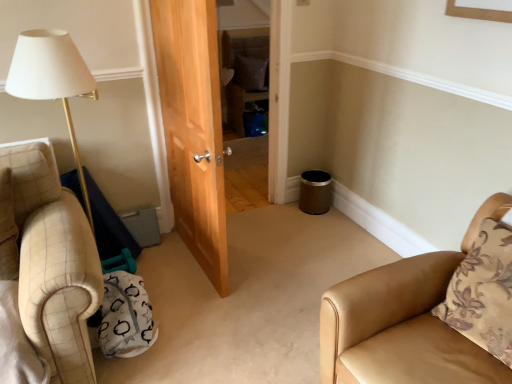
The width and height of the screenshot is (512, 384). Find the location of `brown fabric pillow at center, which appears as the 1th pillow when viewed from the left`. brown fabric pillow at center, which appears as the 1th pillow when viewed from the left is located at coordinates (x=251, y=73).

What do you see at coordinates (251, 73) in the screenshot? This screenshot has width=512, height=384. I see `brown fabric pillow at center, the second pillow positioned from the front` at bounding box center [251, 73].

Find the location of a particular element. Image resolution: width=512 pixels, height=384 pixels. brown fabric pillow at center, acting as the second pillow starting from the bottom is located at coordinates (251, 73).

From the image's perspective, is brown fabric pillow at center, the first pillow viewed from the back, below tan leather chair at lower right?

Incorrect, from the image's perspective, brown fabric pillow at center, the first pillow viewed from the back, is higher than tan leather chair at lower right.

Which is less distant, (250, 76) or (354, 294)?

The point (354, 294) is more forward.

Looking at the image, does brown fabric pillow at center, which is the 1th pillow in top-to-bottom order, seem bigger or smaller compared to tan leather chair at lower right?

Clearly, brown fabric pillow at center, which is the 1th pillow in top-to-bottom order, is smaller in size than tan leather chair at lower right.

Considering the sizes of brown fabric pillow at center, which appears as the 1th pillow when viewed from the left, and tan leather chair at lower right in the image, is brown fabric pillow at center, which appears as the 1th pillow when viewed from the left, taller or shorter than tan leather chair at lower right?

Clearly, brown fabric pillow at center, which appears as the 1th pillow when viewed from the left, is shorter compared to tan leather chair at lower right.

Does tan leather chair at lower right appear on the right side of brown fabric pillow at center, the second pillow positioned from the front?

Yes.

From the picture: Can you confirm if tan leather chair at lower right is shorter than brown fabric pillow at center, which is the second pillow from right to left?

No.

From the picture: From a real-world perspective, is tan leather chair at lower right below brown fabric pillow at center, which is the second pillow from right to left?

Yes.

From a real-world perspective, between brown floral pillow at right, positioned as the 1th pillow in right-to-left order, and tan leather chair at lower right, who is vertically lower?

tan leather chair at lower right is physically lower.

How many degrees apart are the facing directions of brown floral pillow at right, which ranks as the second pillow in left-to-right order, and tan leather chair at lower right?

brown floral pillow at right, which ranks as the second pillow in left-to-right order, and tan leather chair at lower right are facing 0.609 degrees away from each other.

Does brown floral pillow at right, the 2th pillow in the back-to-front sequence, turn towards tan leather chair at lower right?

Yes, brown floral pillow at right, the 2th pillow in the back-to-front sequence, is facing tan leather chair at lower right.

Does point (498, 218) lie behind point (495, 281)?

Yes, it is behind point (495, 281).

From the picture: Does tan leather chair at lower right appear on the right side of brown floral pillow at right, positioned as the 1th pillow in right-to-left order?

No, tan leather chair at lower right is not to the right of brown floral pillow at right, positioned as the 1th pillow in right-to-left order.

Considering the relative sizes of tan leather chair at lower right and brown floral pillow at right, the 2th pillow in the back-to-front sequence, in the image provided, is tan leather chair at lower right smaller than brown floral pillow at right, the 2th pillow in the back-to-front sequence,?

Actually, tan leather chair at lower right might be larger than brown floral pillow at right, the 2th pillow in the back-to-front sequence.

From a real-world perspective, does tan leather chair at lower right stand above brown floral pillow at right, the first pillow in the bottom-to-top sequence?

Actually, tan leather chair at lower right is physically below brown floral pillow at right, the first pillow in the bottom-to-top sequence, in the real world.

Identify the location of pillow lying behind the brown floral pillow at right, the first pillow in the bottom-to-top sequence. (251, 73).

Is brown fabric pillow at center, which is the 1th pillow in top-to-bottom order, to the right of brown floral pillow at right, the 2th pillow in the back-to-front sequence, from the viewer's perspective?

Incorrect, brown fabric pillow at center, which is the 1th pillow in top-to-bottom order, is not on the right side of brown floral pillow at right, the 2th pillow in the back-to-front sequence.

Is brown fabric pillow at center, which is the 1th pillow in top-to-bottom order, closer to camera compared to brown floral pillow at right, the first pillow in the bottom-to-top sequence?

No, the depth of brown fabric pillow at center, which is the 1th pillow in top-to-bottom order, is greater than that of brown floral pillow at right, the first pillow in the bottom-to-top sequence.

Is brown fabric pillow at center, acting as the second pillow starting from the bottom, not inside brown floral pillow at right, which is the second pillow from top to bottom?

Yes, brown fabric pillow at center, acting as the second pillow starting from the bottom, is outside of brown floral pillow at right, which is the second pillow from top to bottom.

Between brown floral pillow at right, which is the 1th pillow from front to back, and brown fabric pillow at center, the first pillow viewed from the back, which one has less height?

brown fabric pillow at center, the first pillow viewed from the back, is shorter.

Is brown floral pillow at right, the first pillow in the bottom-to-top sequence, further to camera compared to brown fabric pillow at center, acting as the second pillow starting from the bottom?

No, the depth of brown floral pillow at right, the first pillow in the bottom-to-top sequence, is less than that of brown fabric pillow at center, acting as the second pillow starting from the bottom.

Would you say brown fabric pillow at center, which is the 1th pillow in top-to-bottom order, is part of brown floral pillow at right, which is the 1th pillow from front to back,'s contents?

That's incorrect, brown fabric pillow at center, which is the 1th pillow in top-to-bottom order, is not inside brown floral pillow at right, which is the 1th pillow from front to back.

I want to click on pillow below the brown fabric pillow at center, which appears as the 1th pillow when viewed from the left (from the image's perspective), so click(483, 292).

This screenshot has width=512, height=384. I want to click on pillow that is on the left side of tan leather chair at lower right, so click(x=251, y=73).

Identify the location of the 2nd pillow above when counting from the tan leather chair at lower right (from the image's perspective). (251, 73).

Estimate the real-world distances between objects in this image. Which object is further from tan leather chair at lower right, brown floral pillow at right, which is the 1th pillow from front to back, or brown fabric pillow at center, the second pillow positioned from the front?

Based on the image, brown fabric pillow at center, the second pillow positioned from the front, appears to be further to tan leather chair at lower right.

When comparing their distances from brown floral pillow at right, which ranks as the second pillow in left-to-right order, does tan leather chair at lower right or brown fabric pillow at center, which appears as the 1th pillow when viewed from the left, seem further?

brown fabric pillow at center, which appears as the 1th pillow when viewed from the left.

Looking at the image, which one is located further to brown fabric pillow at center, which is the 1th pillow in top-to-bottom order, brown floral pillow at right, which is the 1th pillow from front to back, or tan leather chair at lower right?

brown floral pillow at right, which is the 1th pillow from front to back, is positioned further to the anchor brown fabric pillow at center, which is the 1th pillow in top-to-bottom order.

From the image, which object appears to be nearer to brown fabric pillow at center, which is the second pillow from right to left, tan leather chair at lower right or brown floral pillow at right, positioned as the 1th pillow in right-to-left order?

tan leather chair at lower right is closer to brown fabric pillow at center, which is the second pillow from right to left.

When comparing their distances from brown floral pillow at right, which is the 1th pillow from front to back, does brown fabric pillow at center, which is the 1th pillow in top-to-bottom order, or tan leather chair at lower right seem further?

brown fabric pillow at center, which is the 1th pillow in top-to-bottom order.

Based on their spatial positions, is brown fabric pillow at center, which is the 1th pillow in top-to-bottom order, or brown floral pillow at right, the 2th pillow in the back-to-front sequence, further from tan leather chair at lower right?

The object further to tan leather chair at lower right is brown fabric pillow at center, which is the 1th pillow in top-to-bottom order.

Image resolution: width=512 pixels, height=384 pixels. I want to click on pillow between tan leather chair at lower right and brown fabric pillow at center, which is the second pillow from right to left, from front to back, so click(483, 292).